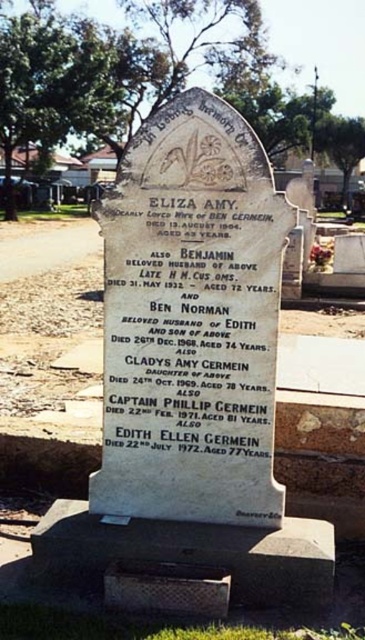
You are standing at the entrance of the cemetery and want to locate the white stone monument at center. According to the coordinates provided, where should you look to find it?

You should look at point [191,369] to find the white stone monument at center.

You are standing in front of the white stone monument at center and the white stone plaque at center. Which object is taller?

The white stone monument at center is much taller than the white stone plaque at center.